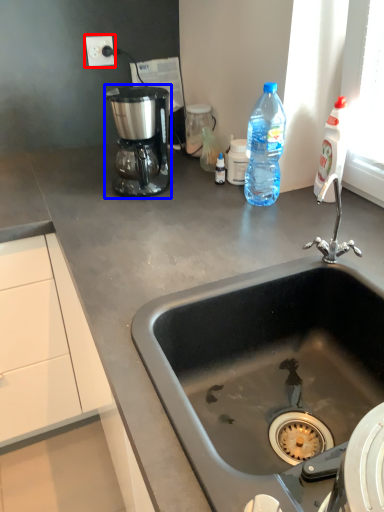
Question: Which of the following is the closest to the observer, electric outlet (highlighted by a red box) or coffee maker (highlighted by a blue box)?

Choices:
 (A) electric outlet
 (B) coffee maker

Answer: (B)